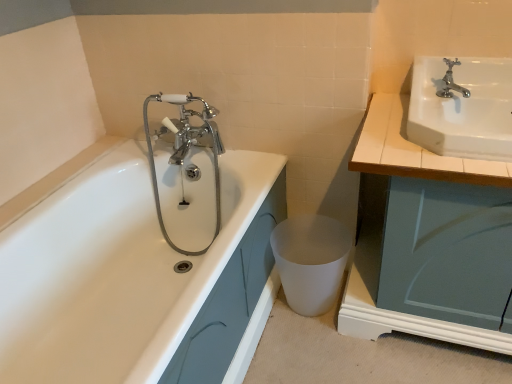
The height and width of the screenshot is (384, 512). In order to click on free space to the left of polished chrome faucet at upper right in this screenshot , I will do `click(389, 109)`.